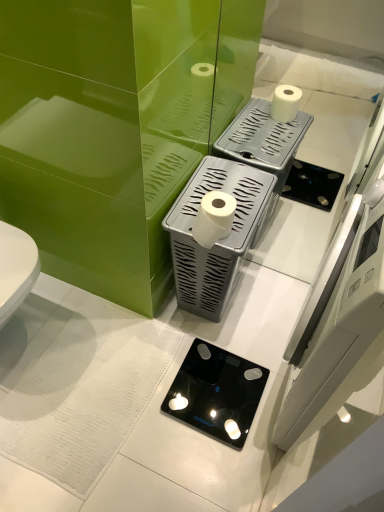
Question: Is white matte toilet paper at center completely or partially outside of black glass scale at center, the second appliance when ordered from top to bottom?

Choices:
 (A) no
 (B) yes

Answer: (B)

Question: Is white matte toilet paper at center at the right side of black glass scale at center, the second appliance when ordered from top to bottom?

Choices:
 (A) no
 (B) yes

Answer: (A)

Question: Is the depth of white matte toilet paper at center greater than that of black glass scale at center, the second appliance when ordered from top to bottom?

Choices:
 (A) no
 (B) yes

Answer: (A)

Question: Is white matte toilet paper at center facing towards black glass scale at center, the second appliance when ordered from top to bottom?

Choices:
 (A) yes
 (B) no

Answer: (B)

Question: From the image's perspective, would you say white matte toilet paper at center is shown under black glass scale at center, marked as the 1th appliance in a bottom-to-top arrangement?

Choices:
 (A) yes
 (B) no

Answer: (B)

Question: Considering the positions of black glass scale at center, the second appliance when ordered from top to bottom, and white plastic toilet paper holder at center, the first appliance viewed from the top, in the image, is black glass scale at center, the second appliance when ordered from top to bottom, wider or thinner than white plastic toilet paper holder at center, the first appliance viewed from the top,?

Choices:
 (A) wide
 (B) thin

Answer: (A)

Question: Is black glass scale at center, marked as the 1th appliance in a bottom-to-top arrangement, to the left or to the right of white plastic toilet paper holder at center, which is counted as the 2th appliance, starting from the bottom, in the image?

Choices:
 (A) left
 (B) right

Answer: (A)

Question: Is point (190, 374) positioned closer to the camera than point (206, 159)?

Choices:
 (A) closer
 (B) farther

Answer: (B)

Question: From a real-world perspective, is black glass scale at center, marked as the 1th appliance in a bottom-to-top arrangement, above or below white plastic toilet paper holder at center, which is counted as the 2th appliance, starting from the bottom?

Choices:
 (A) below
 (B) above

Answer: (A)

Question: Is white matte toilet paper at center to the left or to the right of white plastic toilet paper holder at center, the first appliance viewed from the top, in the image?

Choices:
 (A) right
 (B) left

Answer: (B)

Question: Do you think white matte toilet paper at center is within white plastic toilet paper holder at center, which is counted as the 2th appliance, starting from the bottom, or outside of it?

Choices:
 (A) outside
 (B) inside

Answer: (B)

Question: From the image's perspective, is white matte toilet paper at center located above or below white plastic toilet paper holder at center, the first appliance viewed from the top?

Choices:
 (A) above
 (B) below

Answer: (A)

Question: From a real-world perspective, is white matte toilet paper at center above or below white plastic toilet paper holder at center, the first appliance viewed from the top?

Choices:
 (A) above
 (B) below

Answer: (A)

Question: In terms of height, does white plastic toilet paper holder at center, the first appliance viewed from the top, look taller or shorter compared to black glass scale at center, the second appliance when ordered from top to bottom?

Choices:
 (A) tall
 (B) short

Answer: (A)

Question: From a real-world perspective, is white plastic toilet paper holder at center, which is counted as the 2th appliance, starting from the bottom, above or below black glass scale at center, the second appliance when ordered from top to bottom?

Choices:
 (A) above
 (B) below

Answer: (A)